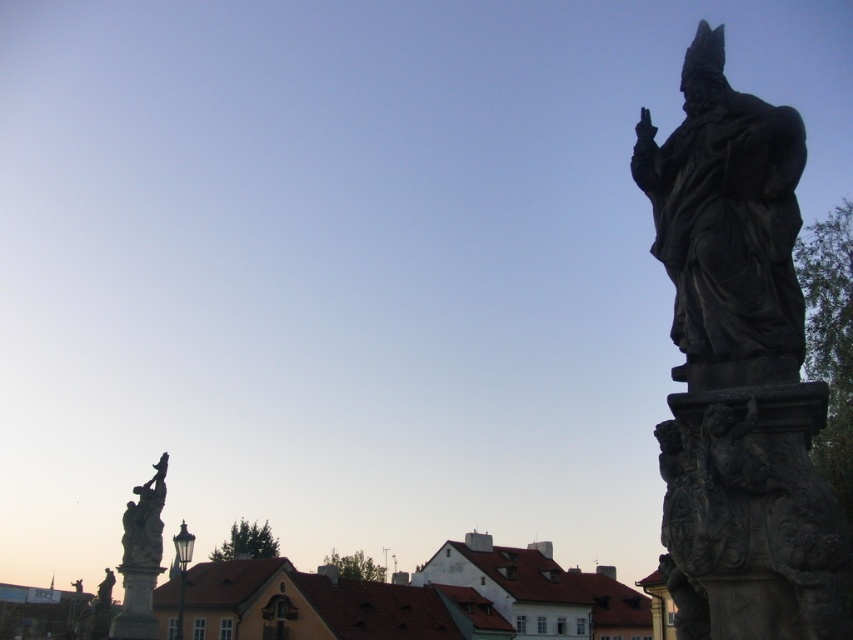
Question: Estimate the real-world distances between objects in this image. Which object is closer to the black stone statue at right?

Choices:
 (A) dark gray stone statue at right
 (B) brown tiled roofs at lower center

Answer: (A)

Question: Considering the relative positions of black stone statue at right and brown tiled roofs at lower center in the image provided, where is black stone statue at right located with respect to brown tiled roofs at lower center?

Choices:
 (A) below
 (B) above

Answer: (B)

Question: Which of the following is the closest to the observer?

Choices:
 (A) dark gray stone statue at right
 (B) brown tiled roofs at lower center

Answer: (A)

Question: Based on their relative distances, which object is nearer to the black stone statue at right?

Choices:
 (A) polished bronze statue at left
 (B) brown tiled roofs at lower center
 (C) dark gray stone statue at right

Answer: (C)

Question: Is dark gray stone statue at right positioned at the back of polished bronze statue at left?

Choices:
 (A) no
 (B) yes

Answer: (A)

Question: Considering the relative positions of black stone statue at right and polished bronze statue at left in the image provided, where is black stone statue at right located with respect to polished bronze statue at left?

Choices:
 (A) right
 (B) left

Answer: (A)